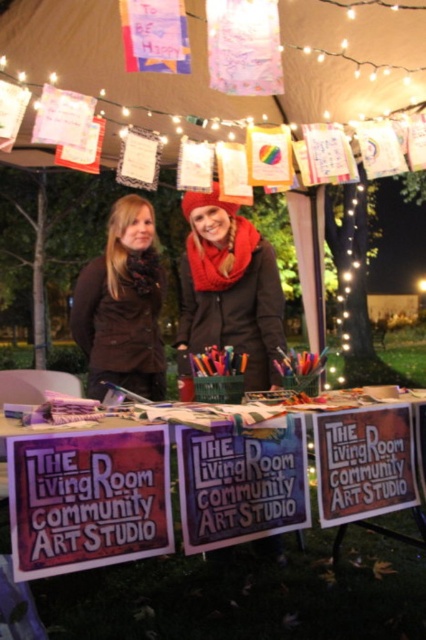
Is metallic purple sign at center positioned in front of brown fuzzy vest at left?

Yes.

Between point (396, 483) and point (126, 358), which one is positioned behind?

Positioned behind is point (126, 358).

Between point (46, 436) and point (121, 291), which one is positioned behind?

The point (121, 291) is behind.

Where is `metallic purple sign at center`? The width and height of the screenshot is (426, 640). metallic purple sign at center is located at coordinates (86, 493).

Consider the image. Is red scarf at center smaller than brown fuzzy vest at left?

Incorrect, red scarf at center is not smaller in size than brown fuzzy vest at left.

Locate an element on the screen. This screenshot has width=426, height=640. red scarf at center is located at coordinates (230, 288).

Can you confirm if metallic purple sign at center is bigger than purple paper sign at center?

Indeed, metallic purple sign at center has a larger size compared to purple paper sign at center.

How distant is metallic purple sign at center from purple paper sign at center?

The distance of metallic purple sign at center from purple paper sign at center is 4.48 inches.

This screenshot has height=640, width=426. Find the location of `metallic purple sign at center`. metallic purple sign at center is located at coordinates (86, 493).